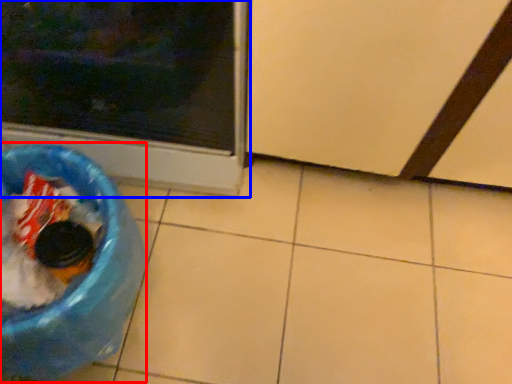
Question: Which point is closer to the camera, recycling bin (highlighted by a red box) or home appliance (highlighted by a blue box)?

Choices:
 (A) recycling bin
 (B) home appliance

Answer: (B)